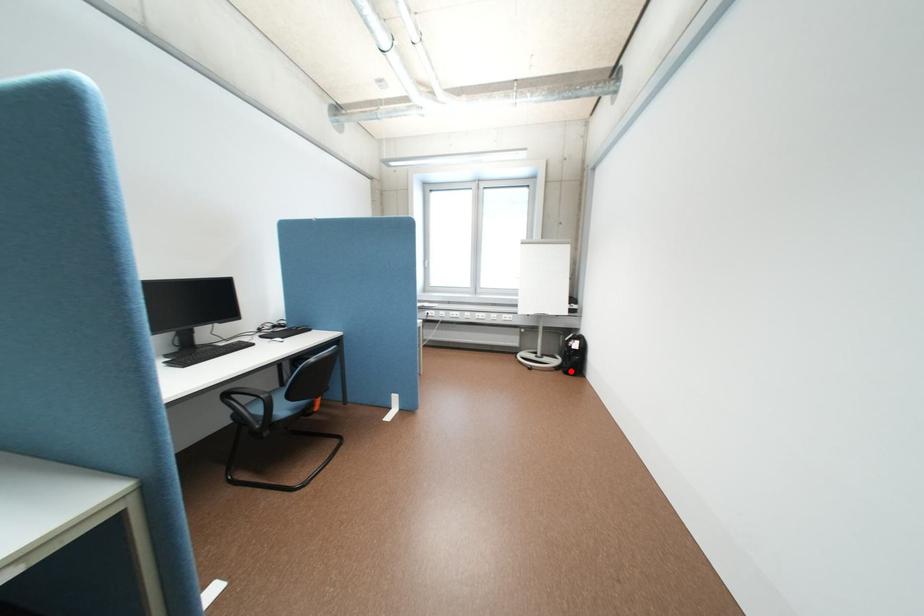
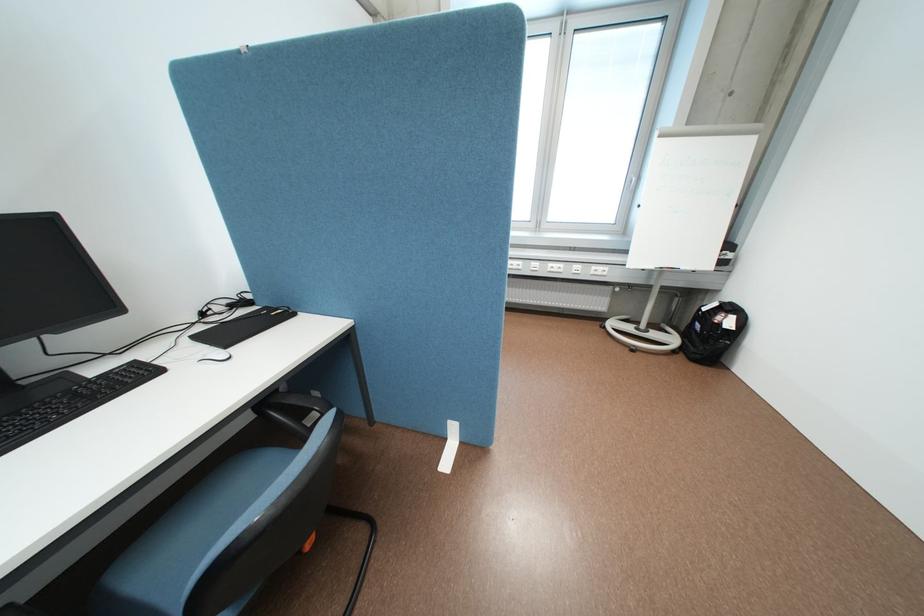
The point at the highlighted location is marked in the first image. Where is the corresponding point in the second image?

(691, 357)